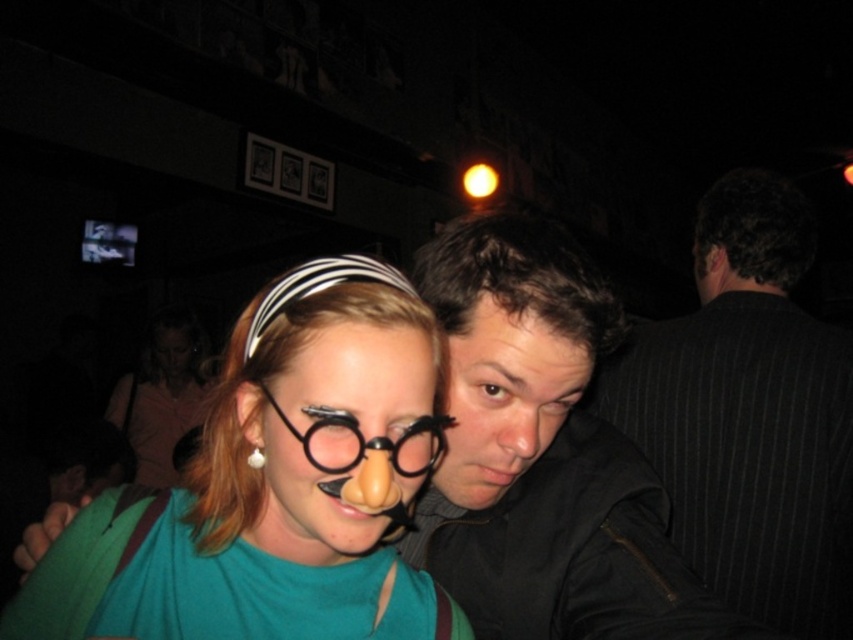
Is point (686, 636) farther from viewer compared to point (148, 404)?

That is False.

What do you see at coordinates (543, 452) in the screenshot?
I see `dark gray jacket at center` at bounding box center [543, 452].

The image size is (853, 640). Identify the location of dark gray jacket at center. (543, 452).

Can you confirm if dark gray jacket at center is positioned below black plastic glasses at center?

Yes, dark gray jacket at center is below black plastic glasses at center.

Is point (485, 508) less distant than point (326, 472)?

No, it is not.

Describe the element at coordinates (543, 452) in the screenshot. The width and height of the screenshot is (853, 640). I see `dark gray jacket at center` at that location.

Locate an element on the screen. dark gray jacket at center is located at coordinates (543, 452).

Which is more to the left, smooth skin face at center or matte pink shirt at center?

From the viewer's perspective, matte pink shirt at center appears more on the left side.

Is smooth skin face at center closer to the viewer compared to matte pink shirt at center?

Yes.

Who is more forward, (503, 419) or (160, 392)?

Point (503, 419) is more forward.

Where is `smooth skin face at center`? smooth skin face at center is located at coordinates (503, 397).